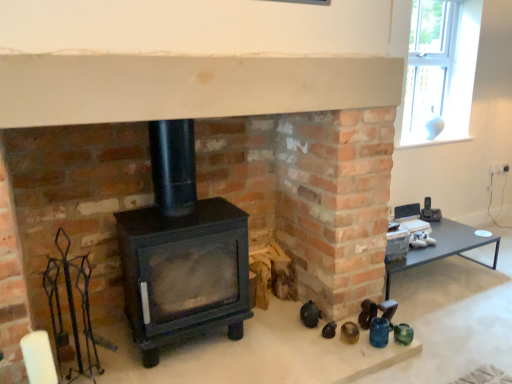
Find the location of a particular element. vacant region in front of matte black table at right is located at coordinates click(452, 326).